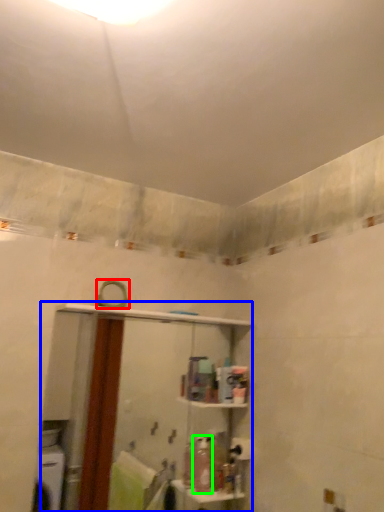
Question: Estimate the real-world distances between objects in this image. Which object is farther from mirror (highlighted by a red box), shelf (highlighted by a blue box) or toiletry (highlighted by a green box)?

Choices:
 (A) shelf
 (B) toiletry

Answer: (A)